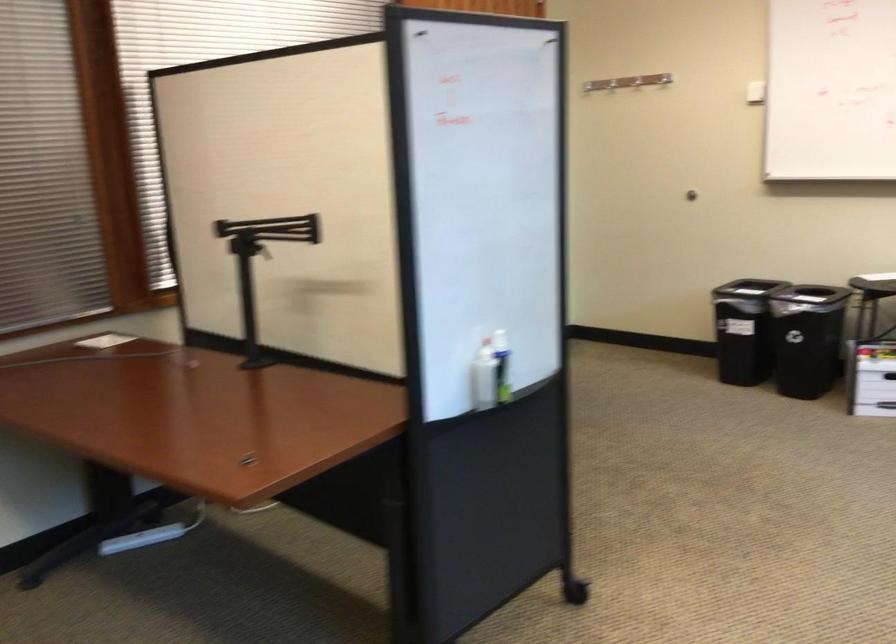
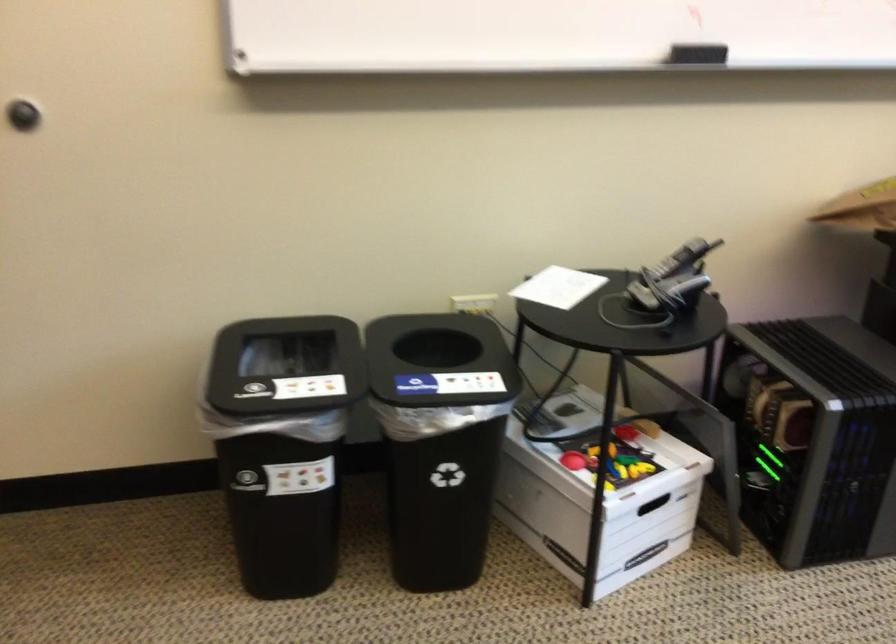
Find the pixel in the second image that matches [814,254] in the first image.

(558, 287)